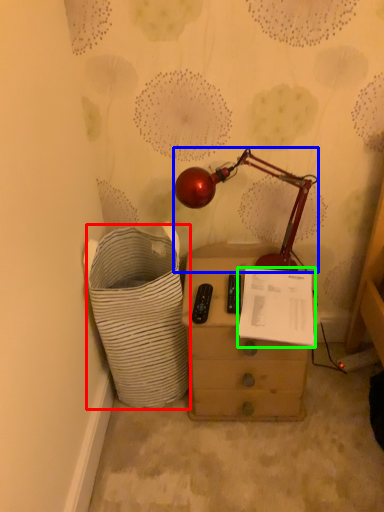
Question: Which object is the farthest from laundry basket (highlighted by a red box)? Choose among these: lamp (highlighted by a blue box) or document (highlighted by a green box).

Choices:
 (A) lamp
 (B) document

Answer: (A)